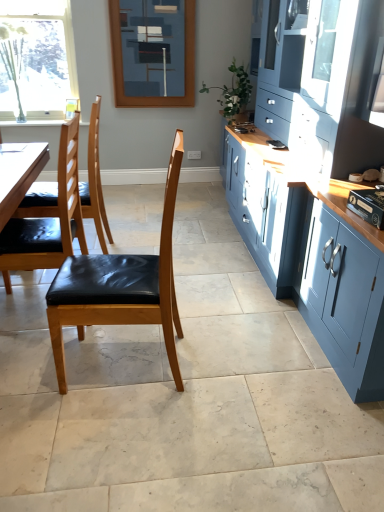
In order to face clear glass window at upper left, should I rotate leftwards or rightwards?

Turn left approximately 20.783 degrees to face it.

This screenshot has width=384, height=512. Describe the element at coordinates (95, 182) in the screenshot. I see `black leather chair at left, positioned as the 3th chair in front-to-back order` at that location.

Describe the element at coordinates (120, 287) in the screenshot. The image size is (384, 512). I see `matte wood chair at left, which is the third chair from back to front` at that location.

Where is `clear glass window at upper left`? This screenshot has height=512, width=384. clear glass window at upper left is located at coordinates click(37, 59).

Which is less distant, (39, 203) or (317, 17)?

Point (39, 203) appears to be farther away from the viewer than point (317, 17).

Is black leather chair at left, which ranks as the 1th chair in back-to-front order, inside or outside of matte blue cabinet at right?

black leather chair at left, which ranks as the 1th chair in back-to-front order, exists outside the volume of matte blue cabinet at right.

Is black leather chair at left, positioned as the 3th chair in front-to-back order, turned away from matte blue cabinet at right?

Absolutely, black leather chair at left, positioned as the 3th chair in front-to-back order, is directed away from matte blue cabinet at right.

Between matte wood chair at left, which is the first chair from front to back, and clear glass window at upper left, which one appears on the left side from the viewer's perspective?

clear glass window at upper left is more to the left.

There is a clear glass window at upper left. At what (x,y) coordinates should I click in order to perform the action: click on the 1st chair below it (from a real-world perspective). Please return your answer as a coordinate pair (x, y). The height and width of the screenshot is (512, 384). Looking at the image, I should click on (120, 287).

Is matte wood chair at left, which is the third chair from back to front, facing towards clear glass window at upper left?

No, matte wood chair at left, which is the third chair from back to front, is not aimed at clear glass window at upper left.

Is point (171, 186) positioned behind point (49, 79)?

That is False.

Consider the image. Which is more to the left, matte wood chair at left, which is the third chair from back to front, or black leather chair at left, which ranks as the 1th chair in back-to-front order?

black leather chair at left, which ranks as the 1th chair in back-to-front order, is more to the left.

From a real-world perspective, between matte wood chair at left, which is the first chair from front to back, and black leather chair at left, which ranks as the 1th chair in back-to-front order, who is vertically lower?

black leather chair at left, which ranks as the 1th chair in back-to-front order, is physically lower.

How distant is matte wood chair at left, which is the third chair from back to front, from black leather chair at left, positioned as the 3th chair in front-to-back order?

matte wood chair at left, which is the third chair from back to front, and black leather chair at left, positioned as the 3th chair in front-to-back order, are 63.91 centimeters apart.

Is point (106, 263) positioned before point (94, 138)?

No.

Between matte black chair at left, arranged as the 2th chair when viewed from the back, and matte blue cabinet at right, which one has smaller size?

With smaller size is matte black chair at left, arranged as the 2th chair when viewed from the back.

From the picture: Is the position of matte black chair at left, placed as the second chair when sorted from front to back, more distant than that of matte blue cabinet at right?

Yes, it is behind matte blue cabinet at right.

How different are the orientations of matte black chair at left, arranged as the 2th chair when viewed from the back, and matte blue cabinet at right in degrees?

The angle between the facing direction of matte black chair at left, arranged as the 2th chair when viewed from the back, and the facing direction of matte blue cabinet at right is 0.652 degrees.

Are matte black chair at left, arranged as the 2th chair when viewed from the back, and matte wood chair at left, which is the third chair from back to front, far apart?

No, matte black chair at left, arranged as the 2th chair when viewed from the back, is not far away from matte wood chair at left, which is the third chair from back to front.

Between matte black chair at left, placed as the second chair when sorted from front to back, and matte wood chair at left, which is the first chair from front to back, which one has larger width?

matte black chair at left, placed as the second chair when sorted from front to back, is wider.

Between matte black chair at left, arranged as the 2th chair when viewed from the back, and matte wood chair at left, which is the third chair from back to front, which one has larger size?

matte black chair at left, arranged as the 2th chair when viewed from the back.

Is matte black chair at left, arranged as the 2th chair when viewed from the back, looking in the opposite direction of matte wood chair at left, which is the first chair from front to back?

matte black chair at left, arranged as the 2th chair when viewed from the back, is not turned away from matte wood chair at left, which is the first chair from front to back.

Are blue painted wood frame at upper center and matte wood chair at left, which is the third chair from back to front, located far from each other?

blue painted wood frame at upper center is far away from matte wood chair at left, which is the third chair from back to front.

Could you tell me if blue painted wood frame at upper center is facing matte wood chair at left, which is the third chair from back to front?

Yes.

Where is `chair that is the 3rd object located in front of the blue painted wood frame at upper center`? chair that is the 3rd object located in front of the blue painted wood frame at upper center is located at coordinates pos(120,287).

Which of these two, blue painted wood frame at upper center or matte wood chair at left, which is the first chair from front to back, stands taller?

matte wood chair at left, which is the first chair from front to back.

Is matte blue cabinet at right wider than matte black chair at left, placed as the second chair when sorted from front to back?

Yes, matte blue cabinet at right is wider than matte black chair at left, placed as the second chair when sorted from front to back.

From the image's perspective, is matte blue cabinet at right below matte black chair at left, arranged as the 2th chair when viewed from the back?

No, from the image's perspective, matte blue cabinet at right is not beneath matte black chair at left, arranged as the 2th chair when viewed from the back.

Is matte blue cabinet at right to the left or to the right of matte black chair at left, arranged as the 2th chair when viewed from the back, in the image?

In the image, matte blue cabinet at right appears on the right side of matte black chair at left, arranged as the 2th chair when viewed from the back.

Is matte blue cabinet at right looking in the opposite direction of matte black chair at left, placed as the second chair when sorted from front to back?

matte blue cabinet at right is not turned away from matte black chair at left, placed as the second chair when sorted from front to back.

At what (x,y) coordinates should I click in order to perform the action: click on cabinetry that is on the right side of black leather chair at left, which ranks as the 1th chair in back-to-front order. Please return your answer as a coordinate pair (x, y). Looking at the image, I should click on (316, 178).

Where is `window behind the matte wood chair at left, which is the first chair from front to back`? This screenshot has height=512, width=384. window behind the matte wood chair at left, which is the first chair from front to back is located at coordinates (37, 59).

When comparing their distances from black leather chair at left, positioned as the 3th chair in front-to-back order, does blue painted wood frame at upper center or clear glass window at upper left seem closer?

Based on the image, blue painted wood frame at upper center appears to be nearer to black leather chair at left, positioned as the 3th chair in front-to-back order.

Estimate the real-world distances between objects in this image. Which object is closer to clear glass window at upper left, black leather chair at left, which ranks as the 1th chair in back-to-front order, or blue painted wood frame at upper center?

Based on the image, blue painted wood frame at upper center appears to be nearer to clear glass window at upper left.

Based on their spatial positions, is blue painted wood frame at upper center or black leather chair at left, positioned as the 3th chair in front-to-back order, further from matte wood chair at left, which is the third chair from back to front?

blue painted wood frame at upper center lies further to matte wood chair at left, which is the third chair from back to front, than the other object.

From the picture: Looking at the image, which one is located further to clear glass window at upper left, blue painted wood frame at upper center or matte black chair at left, placed as the second chair when sorted from front to back?

Based on the image, matte black chair at left, placed as the second chair when sorted from front to back, appears to be further to clear glass window at upper left.

Which object lies further to the anchor point matte black chair at left, arranged as the 2th chair when viewed from the back, matte blue cabinet at right or blue painted wood frame at upper center?

blue painted wood frame at upper center lies further to matte black chair at left, arranged as the 2th chair when viewed from the back, than the other object.

From the image, which object appears to be farther from blue painted wood frame at upper center, black leather chair at left, which ranks as the 1th chair in back-to-front order, or clear glass window at upper left?

black leather chair at left, which ranks as the 1th chair in back-to-front order, lies further to blue painted wood frame at upper center than the other object.

Based on their spatial positions, is matte black chair at left, arranged as the 2th chair when viewed from the back, or blue painted wood frame at upper center further from matte blue cabinet at right?

blue painted wood frame at upper center lies further to matte blue cabinet at right than the other object.

From the picture: Which object lies nearer to the anchor point matte black chair at left, arranged as the 2th chair when viewed from the back, clear glass window at upper left or matte blue cabinet at right?

Based on the image, matte blue cabinet at right appears to be nearer to matte black chair at left, arranged as the 2th chair when viewed from the back.

Locate an element on the screen. window screen between matte blue cabinet at right and clear glass window at upper left in the front-back direction is located at coordinates coord(153,52).

This screenshot has height=512, width=384. In order to click on window that lies between blue painted wood frame at upper center and black leather chair at left, which ranks as the 1th chair in back-to-front order, from top to bottom in this screenshot , I will do `click(37, 59)`.

Identify the location of chair situated between matte black chair at left, arranged as the 2th chair when viewed from the back, and matte blue cabinet at right from left to right. (120, 287).

Identify the location of window screen positioned between matte wood chair at left, which is the third chair from back to front, and clear glass window at upper left from near to far. This screenshot has width=384, height=512. click(x=153, y=52).